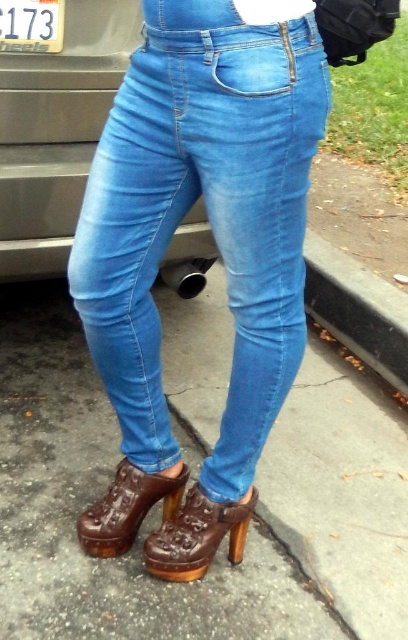
Which is more to the left, denim jeans at center or brown leather boot at lower center?

From the viewer's perspective, brown leather boot at lower center appears more on the left side.

Locate an element on the screen. denim jeans at center is located at coordinates (208, 216).

Does denim jeans at center have a greater height compared to white plastic license plate at upper left?

Yes, denim jeans at center is taller than white plastic license plate at upper left.

Is denim jeans at center positioned before white plastic license plate at upper left?

Yes.

Between point (155, 358) and point (57, 1), which one is positioned behind?

Positioned behind is point (57, 1).

The height and width of the screenshot is (640, 408). Identify the location of denim jeans at center. (208, 216).

Can you confirm if denim jeans at center is smaller than brown leather sandal at lower center?

Actually, denim jeans at center might be larger than brown leather sandal at lower center.

Who is positioned more to the left, denim jeans at center or brown leather sandal at lower center?

denim jeans at center

Does point (266, 284) lie in front of point (241, 524)?

Yes, it is.

You are a GUI agent. You are given a task and a screenshot of the screen. Output one action in this format:
    pyautogui.click(x=<x>, y=<y>)
    Task: Click on the denim jeans at center
    
    Given the screenshot: What is the action you would take?
    pyautogui.click(x=208, y=216)